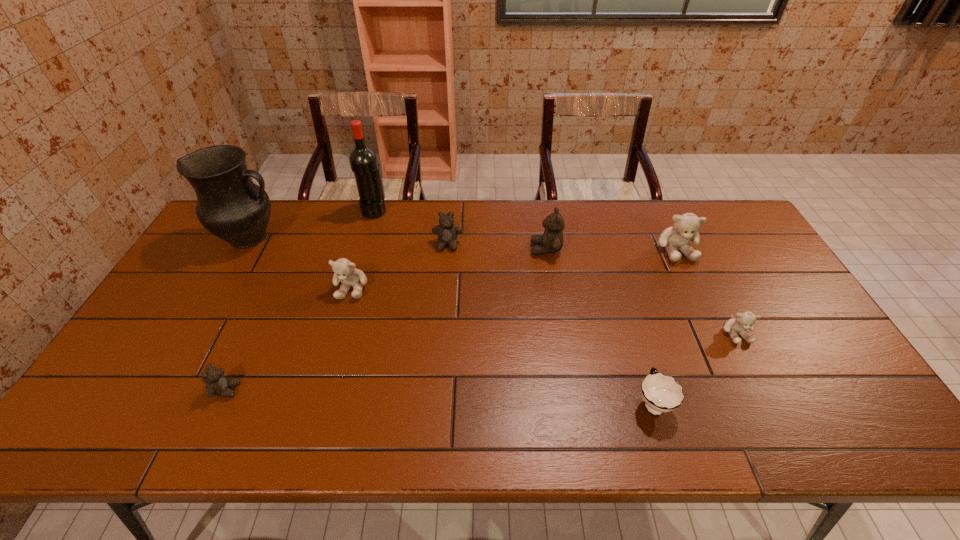
Where is `vacant space at the near right corner of the desktop`? vacant space at the near right corner of the desktop is located at coordinates (827, 437).

You are a GUI agent. You are given a task and a screenshot of the screen. Output one action in this format:
    pyautogui.click(x=<x>, y=<y>)
    Task: Click on the free space between the wine bottle and the leftmost object
    
    Given the screenshot: What is the action you would take?
    pyautogui.click(x=313, y=224)

At what (x,y) coordinates should I click in order to perform the action: click on empty space between the farthest gray teddy bear and the wine bottle. Please return your answer as a coordinate pair (x, y). The width and height of the screenshot is (960, 540). Looking at the image, I should click on (525, 230).

Locate an element on the screen. The height and width of the screenshot is (540, 960). blank region between the eighth shortest object and the smallest brown teddy bear is located at coordinates (238, 314).

The image size is (960, 540). In order to click on vacant space in between the fifth farthest teddy bear and the second smallest brown teddy bear in this screenshot , I will do `click(591, 289)`.

At what (x,y) coordinates should I click in order to perform the action: click on free space between the wine bottle and the farthest gray teddy bear. Please return your answer as a coordinate pair (x, y). Looking at the image, I should click on (525, 230).

Locate an element on the screen. This screenshot has height=540, width=960. free spot between the white cup and the third teddy bear from right to left is located at coordinates (599, 326).

At what (x,y) coordinates should I click in order to perform the action: click on free spot between the leftmost brown teddy bear and the second tallest object. Please return your answer as a coordinate pair (x, y). The image size is (960, 540). Looking at the image, I should click on (238, 314).

Identify the location of free area in between the fifth farthest teddy bear and the wine bottle. The height and width of the screenshot is (540, 960). (555, 272).

Point out which object is positioned as the fifth nearest to the seventh farthest object. Please provide its 2D coordinates. Your answer should be formatted as a tuple, i.e. [(x, y)], where the tuple contains the x and y coordinates of a point satisfying the conditions above.

[(344, 270)]